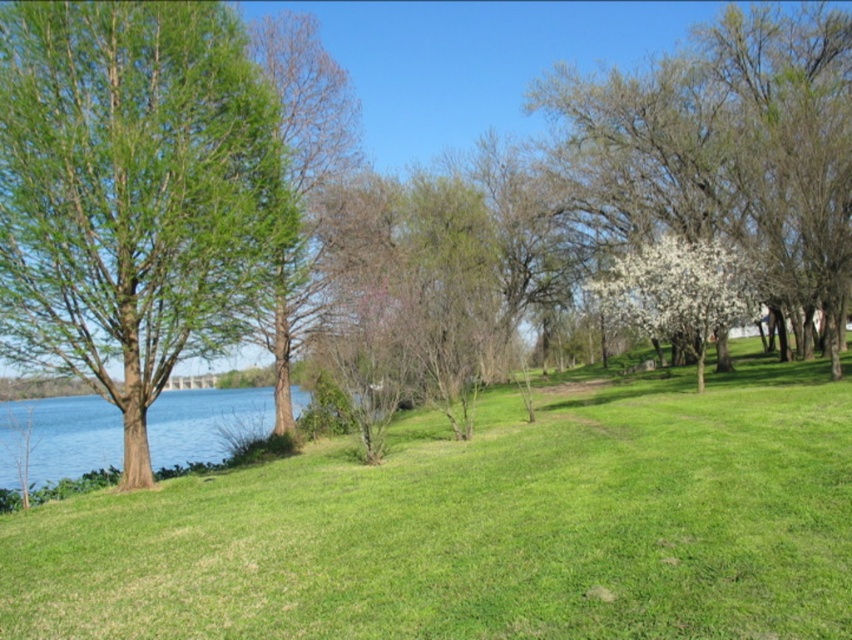
Question: Which object is the closest to the white blossoming tree at center?

Choices:
 (A) green leafy tree at left
 (B) white blossoming tree at center-right

Answer: (B)

Question: Is green leafy tree at left below white blossoming tree at center?

Choices:
 (A) no
 (B) yes

Answer: (B)

Question: Is white blossoming tree at center to the right of white blossoming tree at center-right from the viewer's perspective?

Choices:
 (A) yes
 (B) no

Answer: (A)

Question: Considering the relative positions of green leafy tree at left and white blossoming tree at center-right in the image provided, where is green leafy tree at left located with respect to white blossoming tree at center-right?

Choices:
 (A) right
 (B) left

Answer: (B)

Question: Which point is closer to the camera?

Choices:
 (A) white blossoming tree at center
 (B) green leafy tree at left

Answer: (B)

Question: Which object appears closest to the camera in this image?

Choices:
 (A) white blossoming tree at center-right
 (B) green grassy at lower left

Answer: (B)